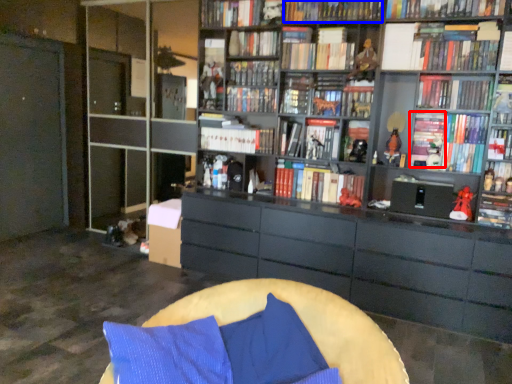
Question: Which point is further to the camera, book (highlighted by a red box) or book (highlighted by a blue box)?

Choices:
 (A) book
 (B) book

Answer: (A)